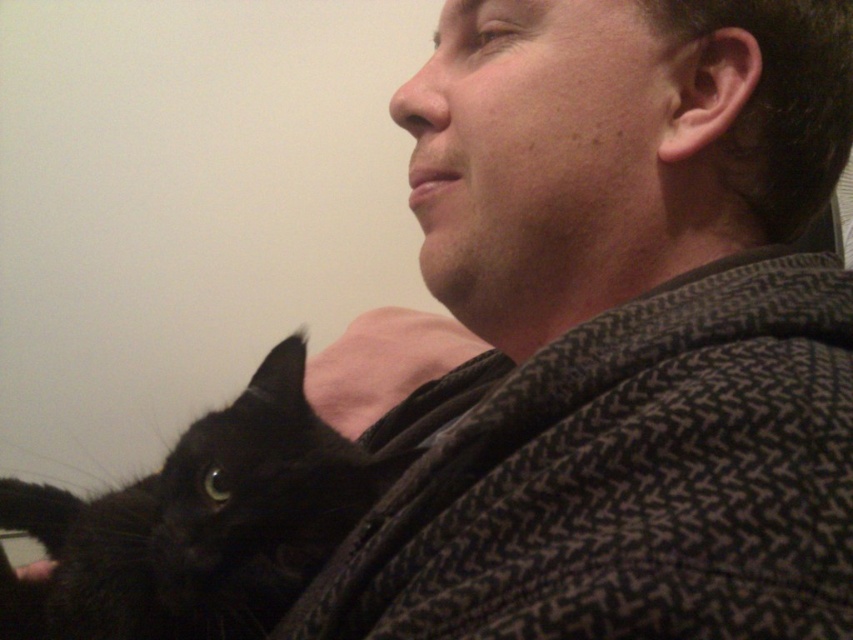
Who is higher up, textured wool sweater at center or black fur cat at lower left?

textured wool sweater at center is above.

Does textured wool sweater at center lie in front of black fur cat at lower left?

Yes, textured wool sweater at center is in front of black fur cat at lower left.

At what (x,y) coordinates should I click in order to perform the action: click on textured wool sweater at center. Please return your answer as a coordinate pair (x, y). The height and width of the screenshot is (640, 853). Looking at the image, I should click on (619, 332).

Where is `textured wool sweater at center`? textured wool sweater at center is located at coordinates (619, 332).